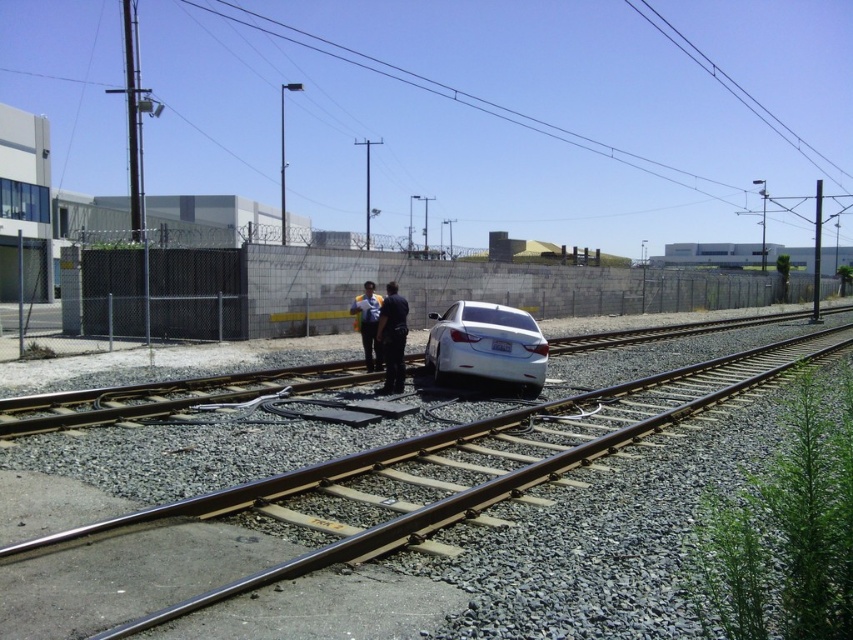
Based on the photo, you are a pedestrian trying to cross the railway tracks safely. You see the smooth metal train track at center and the blue shirt at center. Which object should you avoid stepping on to stay safe?

You should avoid stepping on the smooth metal train track at center because it is larger and designed for trains, not pedestrians.

You are a train conductor approaching the railway tracks with a train that requires a clear path. You notice the dark blue uniform at center and the blue shirt at center in the image. Which of these two is closer to the tracks?

The dark blue uniform at center is positioned under blue shirt at center, meaning it is closer to the tracks.

You are a train engineer approaching the industrial area depicted in the image. You notice two points marked on the tracks ahead. The first point is at coordinates point [413,520] and the second at point [440,355]. Which of these points is closer to your current position as you approach the tracks?

Point [413,520] is closer to the viewer than point [440,355], so the first point is closer to your current position.